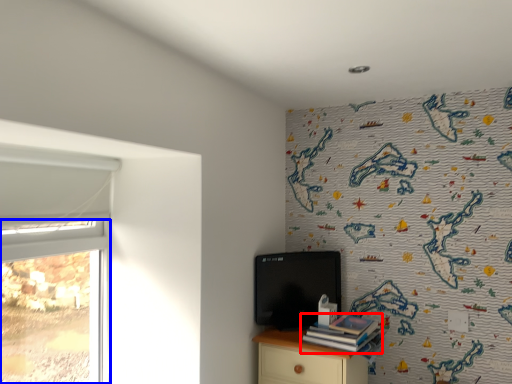
Question: Which object is closer to the camera taking this photo, book (highlighted by a red box) or window (highlighted by a blue box)?

Choices:
 (A) book
 (B) window

Answer: (B)